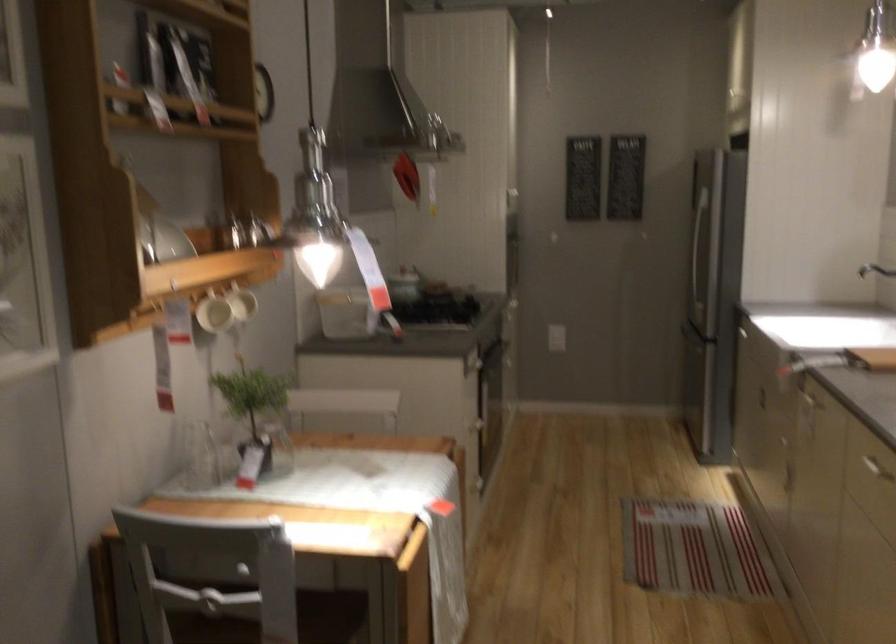
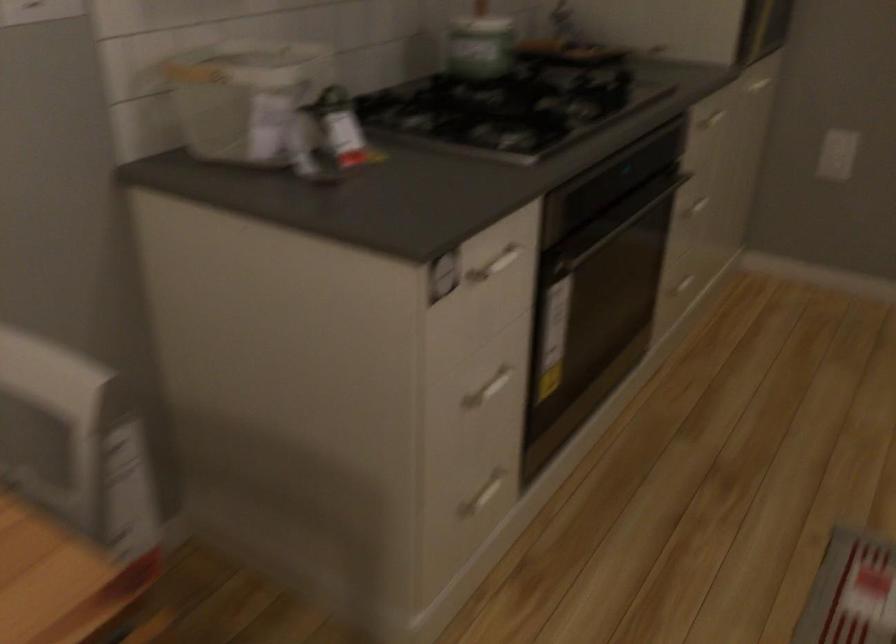
Question: In a continuous first-person perspective shot, in which direction is the camera moving?

Choices:
 (A) Left
 (B) Right
 (C) Forward
 (D) Backward

Answer: (C)